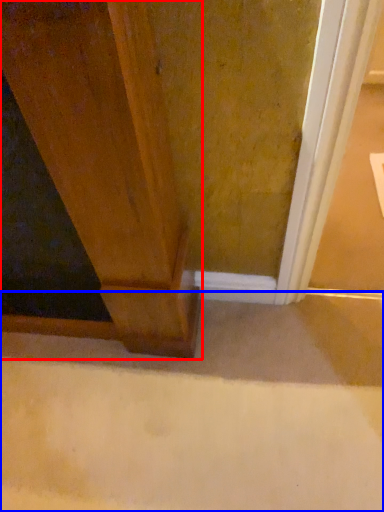
Question: Which object appears farthest to the camera in this image, door (highlighted by a red box) or concrete (highlighted by a blue box)?

Choices:
 (A) door
 (B) concrete

Answer: (B)